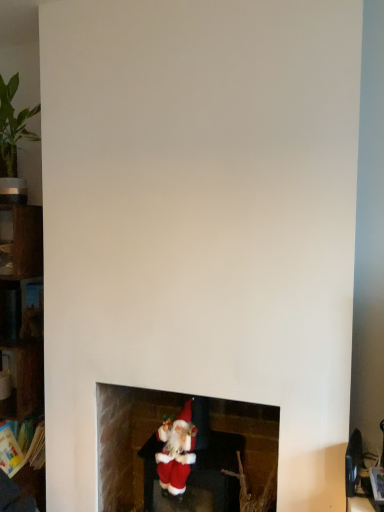
Question: Could you tell me if green matte plant at lower center is facing metallic dark gray shelf at left, the second shelf positioned from the bottom?

Choices:
 (A) no
 (B) yes

Answer: (A)

Question: Does green matte plant at lower center have a greater height compared to metallic dark gray shelf at left, the 1th shelf in the top-to-bottom sequence?

Choices:
 (A) no
 (B) yes

Answer: (B)

Question: Is green matte plant at lower center shorter than metallic dark gray shelf at left, the 1th shelf in the top-to-bottom sequence?

Choices:
 (A) no
 (B) yes

Answer: (A)

Question: Considering the relative sizes of green matte plant at lower center and metallic dark gray shelf at left, the second shelf positioned from the bottom, in the image provided, is green matte plant at lower center thinner than metallic dark gray shelf at left, the second shelf positioned from the bottom,?

Choices:
 (A) yes
 (B) no

Answer: (B)

Question: Considering the relative positions of green matte plant at lower center and metallic dark gray shelf at left, the second shelf positioned from the bottom, in the image provided, is green matte plant at lower center to the right of metallic dark gray shelf at left, the second shelf positioned from the bottom, from the viewer's perspective?

Choices:
 (A) no
 (B) yes

Answer: (B)

Question: From the image's perspective, would you say green matte plant at lower center is shown under metallic dark gray shelf at left, the 1th shelf in the top-to-bottom sequence?

Choices:
 (A) no
 (B) yes

Answer: (B)

Question: Is red plush santa at lower center at the right side of metallic dark gray shelf at left, the 1th shelf in the top-to-bottom sequence?

Choices:
 (A) no
 (B) yes

Answer: (B)

Question: Is red plush santa at lower center bigger than metallic dark gray shelf at left, the second shelf positioned from the bottom?

Choices:
 (A) no
 (B) yes

Answer: (B)

Question: Is red plush santa at lower center facing away from metallic dark gray shelf at left, the second shelf positioned from the bottom?

Choices:
 (A) yes
 (B) no

Answer: (B)

Question: Is red plush santa at lower center shorter than metallic dark gray shelf at left, the 1th shelf in the top-to-bottom sequence?

Choices:
 (A) yes
 (B) no

Answer: (B)

Question: Is red plush santa at lower center taller than metallic dark gray shelf at left, the second shelf positioned from the bottom?

Choices:
 (A) yes
 (B) no

Answer: (A)

Question: Is red plush santa at lower center far away from metallic dark gray shelf at left, the second shelf positioned from the bottom?

Choices:
 (A) yes
 (B) no

Answer: (B)

Question: Is velvet santa at lower center aimed at red plush santa at lower center?

Choices:
 (A) no
 (B) yes

Answer: (B)